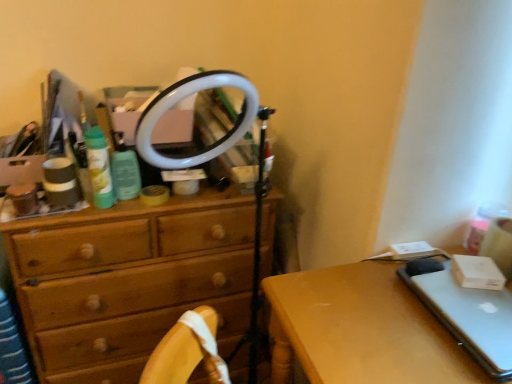
Question: Does wooden chest of drawers at center have a lesser height compared to wooden drawer at center?

Choices:
 (A) no
 (B) yes

Answer: (A)

Question: Does wooden chest of drawers at center have a greater width compared to wooden drawer at center?

Choices:
 (A) no
 (B) yes

Answer: (B)

Question: Is wooden chest of drawers at center closer to camera compared to wooden drawer at center?

Choices:
 (A) yes
 (B) no

Answer: (B)

Question: Does wooden chest of drawers at center come behind wooden drawer at center?

Choices:
 (A) no
 (B) yes

Answer: (B)

Question: Is wooden chest of drawers at center turned away from wooden drawer at center?

Choices:
 (A) no
 (B) yes

Answer: (A)

Question: Is wooden drawer at center a part of wooden chest of drawers at center?

Choices:
 (A) yes
 (B) no

Answer: (B)

Question: Is silver metallic laptop at right facing towards wooden chest of drawers at center?

Choices:
 (A) no
 (B) yes

Answer: (A)

Question: Does silver metallic laptop at right have a smaller size compared to wooden chest of drawers at center?

Choices:
 (A) yes
 (B) no

Answer: (A)

Question: Is silver metallic laptop at right placed right next to wooden chest of drawers at center?

Choices:
 (A) no
 (B) yes

Answer: (A)

Question: Can you confirm if silver metallic laptop at right is thinner than wooden chest of drawers at center?

Choices:
 (A) yes
 (B) no

Answer: (A)

Question: Is wooden chest of drawers at center surrounded by silver metallic laptop at right?

Choices:
 (A) no
 (B) yes

Answer: (A)

Question: Does silver metallic laptop at right appear on the right side of wooden chest of drawers at center?

Choices:
 (A) yes
 (B) no

Answer: (A)

Question: Is wooden chest of drawers at center facing towards silver metallic laptop at right?

Choices:
 (A) no
 (B) yes

Answer: (A)